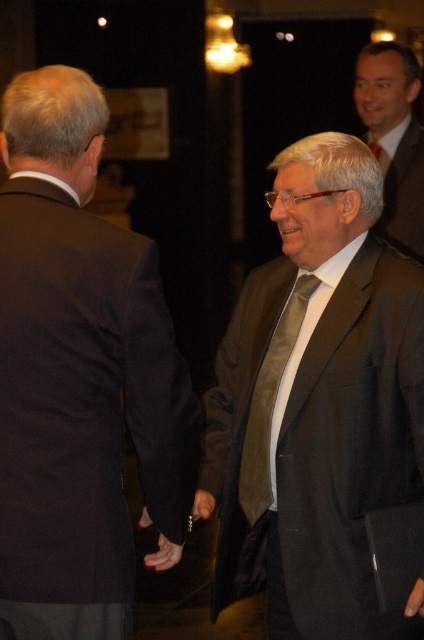
You are a photographer at a formal event. You need to capture a clear photo of both the matte brown suit at center and the satin gold tie at center. Which object should you focus on first to ensure both are in focus?

The matte brown suit at center is taller than the satin gold tie at center, so focusing on the taller object first will ensure both are in focus.

You are a photographer at a formal event. You want to capture a photo of both the matte brown suit at center and the matte brown suit at upper right in the same frame. The camera you are using has a maximum focus range of 2.5 meters. Can you fit both subjects into the frame without moving closer or farther away?

The matte brown suit at center and matte brown suit at upper right are 2.55 meters apart. Since the distance between them exceeds the camera maximum focus range of 2.5 meters, you cannot fit both subjects into the frame without adjusting your position.